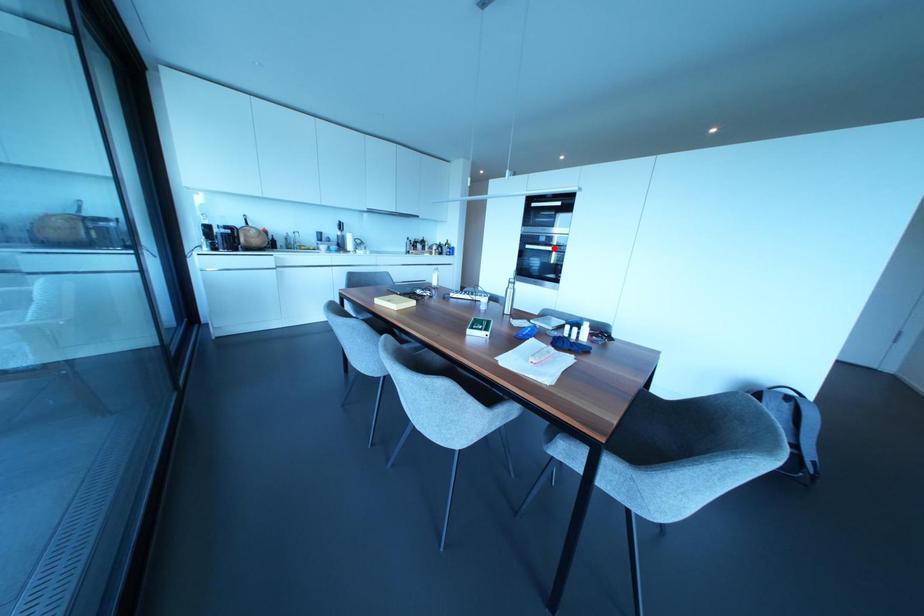
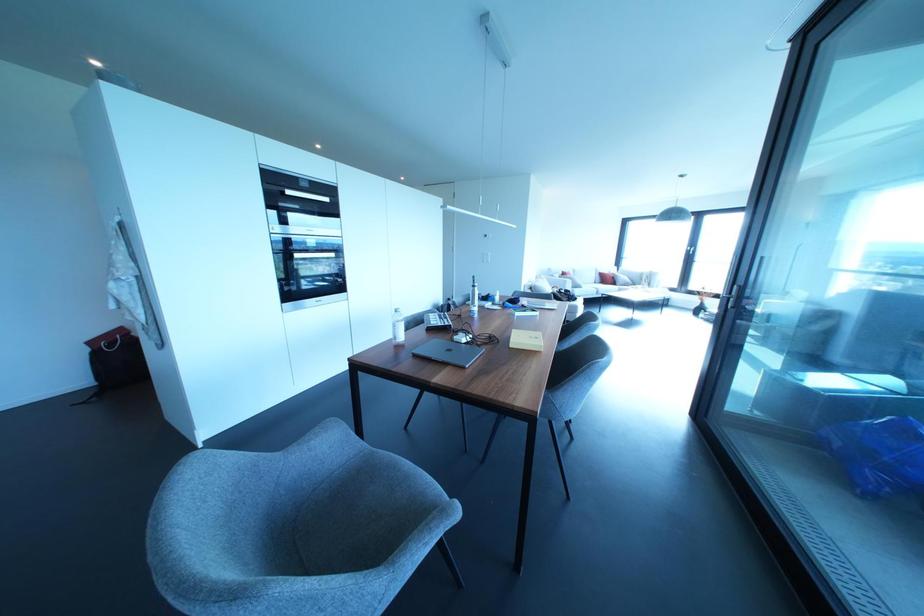
The point at the highlighted location is marked in the first image. Where is the corresponding point in the second image?

(332, 254)